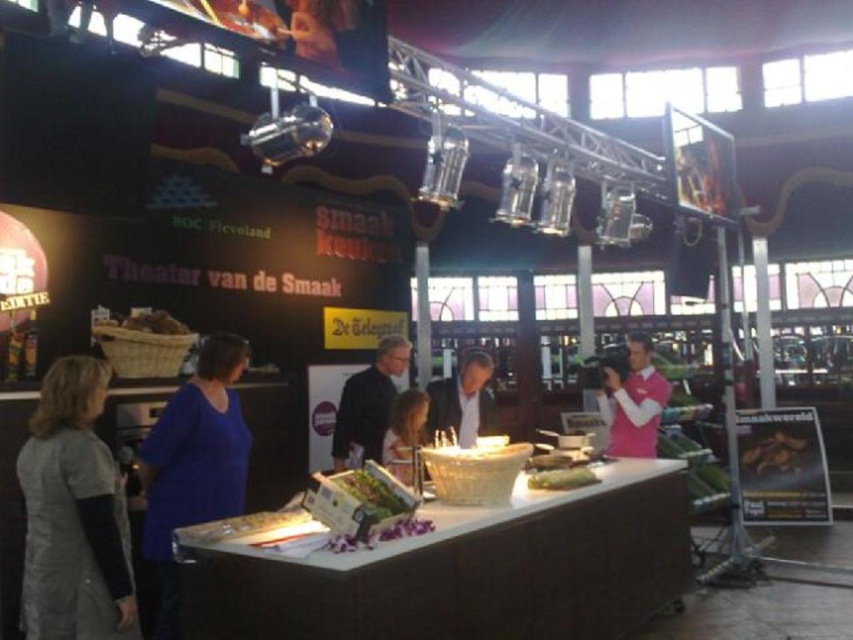
Is gray fabric dress at left bigger than green leafy vegetables at center?

Yes, gray fabric dress at left is bigger than green leafy vegetables at center.

This screenshot has width=853, height=640. What do you see at coordinates (73, 513) in the screenshot?
I see `gray fabric dress at left` at bounding box center [73, 513].

Is point (51, 460) more distant than point (384, 474)?

That is False.

Identify the location of gray fabric dress at left. This screenshot has width=853, height=640. (73, 513).

Can you confirm if blue fabric shirt at left is thinner than brown matte bread at lower right?

Yes, blue fabric shirt at left is thinner than brown matte bread at lower right.

Does point (218, 417) come farther from viewer compared to point (775, 452)?

That is False.

This screenshot has width=853, height=640. Describe the element at coordinates (193, 465) in the screenshot. I see `blue fabric shirt at left` at that location.

Locate an element on the screen. This screenshot has height=640, width=853. blue fabric shirt at left is located at coordinates (193, 465).

Who is shorter, blue fabric shirt at left or light brown hair at center?

light brown hair at center is shorter.

Can you confirm if blue fabric shirt at left is wider than light brown hair at center?

Yes, blue fabric shirt at left is wider than light brown hair at center.

Between point (155, 538) and point (397, 474), which one is positioned behind?

The point (397, 474) is more distant.

Find the location of a particular element. blue fabric shirt at left is located at coordinates (193, 465).